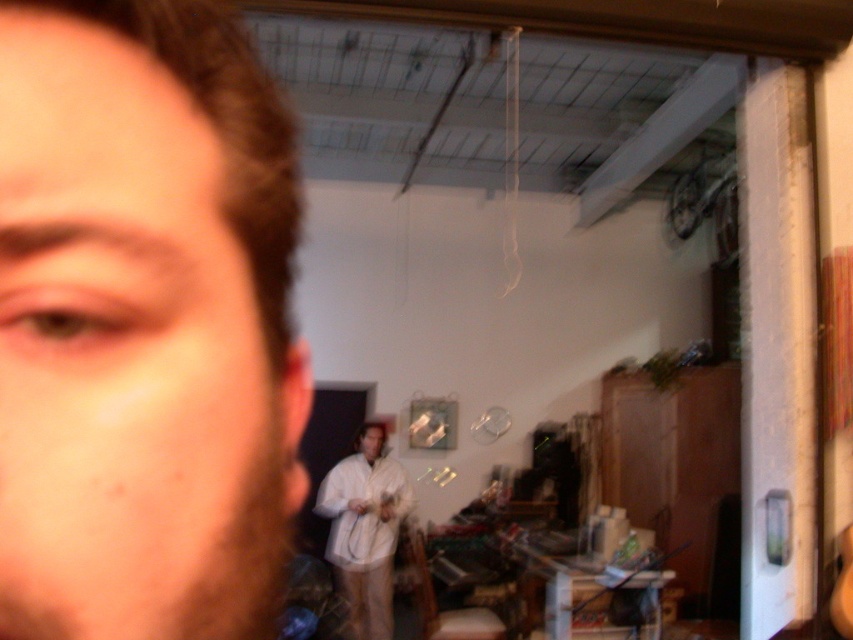
Between white matte coat at center and white matte shirt at center, which one has more height?

Standing taller between the two is white matte coat at center.

Does white matte coat at center have a smaller size compared to white matte shirt at center?

No.

Does point (360, 586) lie in front of point (364, 438)?

Yes.

This screenshot has height=640, width=853. What are the coordinates of `white matte coat at center` in the screenshot? It's located at (364, 536).

Is brown fuzzy beard at lower left below white matte shirt at center?

No.

Does point (271, 621) come behind point (369, 440)?

No, (271, 621) is in front of (369, 440).

Which is behind, point (165, 557) or point (374, 452)?

Positioned behind is point (374, 452).

The width and height of the screenshot is (853, 640). I want to click on brown fuzzy beard at lower left, so click(x=161, y=548).

Based on the photo, which of these two, matte skin at center or white matte coat at center, stands shorter?

matte skin at center

Is matte skin at center to the right of white matte coat at center from the viewer's perspective?

Correct, you'll find matte skin at center to the right of white matte coat at center.

Which is in front, point (86, 92) or point (352, 456)?

Point (86, 92) is in front.

Identify the location of matte skin at center. The height and width of the screenshot is (640, 853). (144, 324).